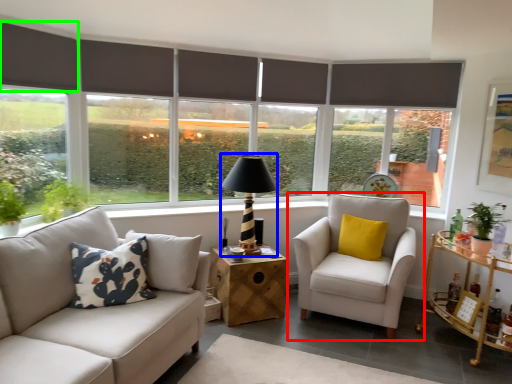
Question: Estimate the real-world distances between objects in this image. Which object is closer to chair (highlighted by a red box), table lamp (highlighted by a blue box) or shutter (highlighted by a green box)?

Choices:
 (A) table lamp
 (B) shutter

Answer: (A)